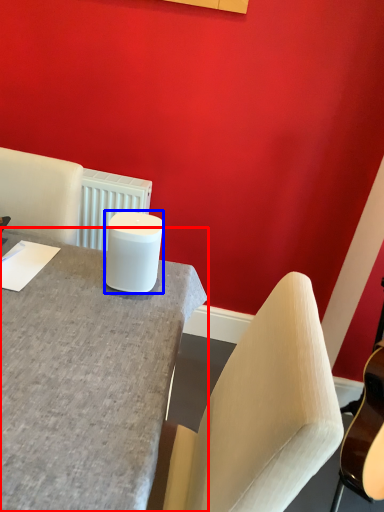
Question: Which object appears farthest to the camera in this image, desk (highlighted by a red box) or candle holder (highlighted by a blue box)?

Choices:
 (A) desk
 (B) candle holder

Answer: (B)